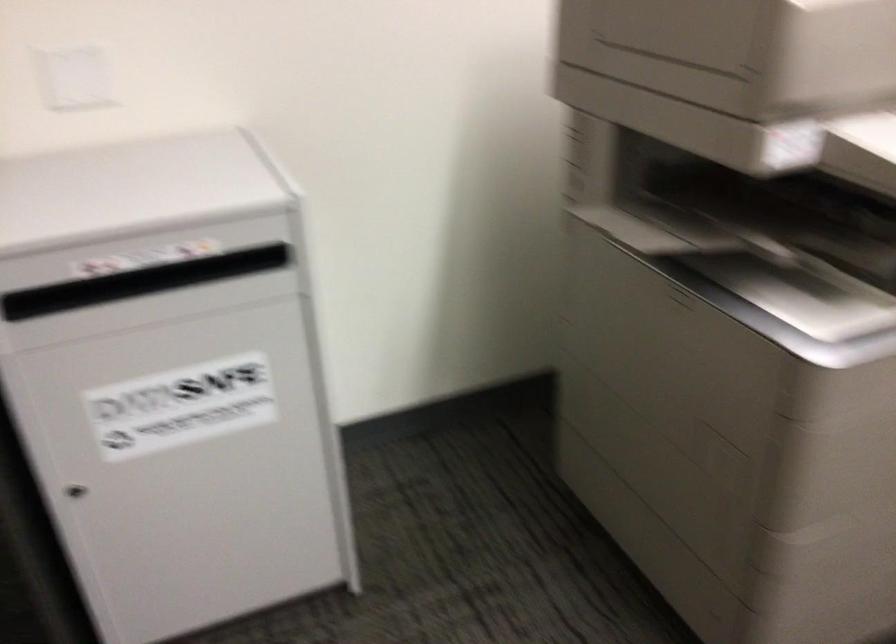
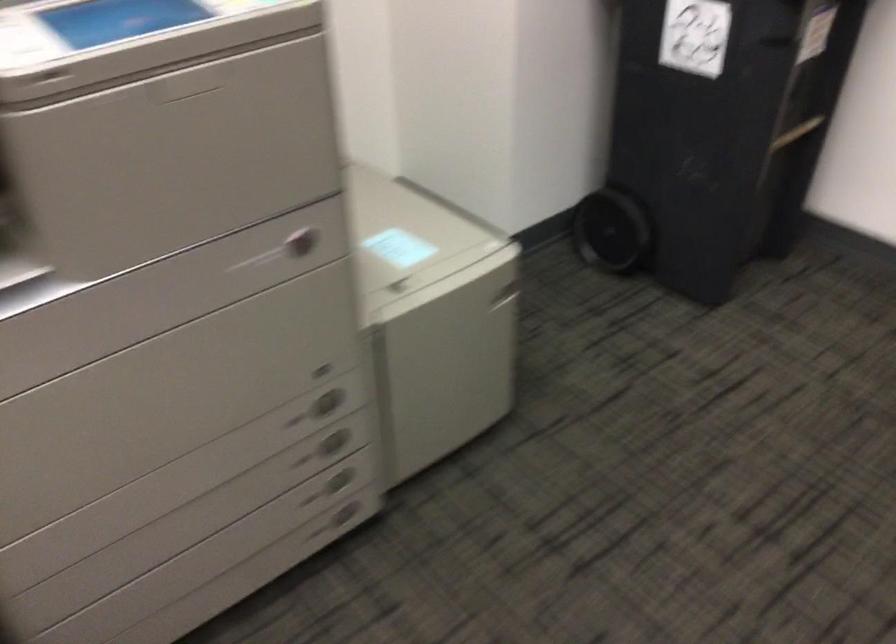
Question: Based on the continuous images, in which direction is the camera rotating? Reply with the corresponding letter.

Choices:
 (A) Left
 (B) Right
 (C) Up
 (D) Down

Answer: (B)